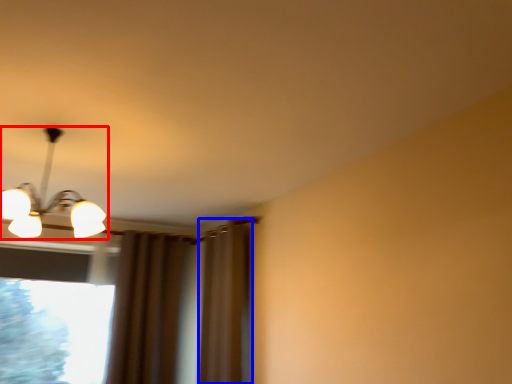
Question: Among these objects, which one is farthest to the camera, lamp (highlighted by a red box) or curtain (highlighted by a blue box)?

Choices:
 (A) lamp
 (B) curtain

Answer: (B)